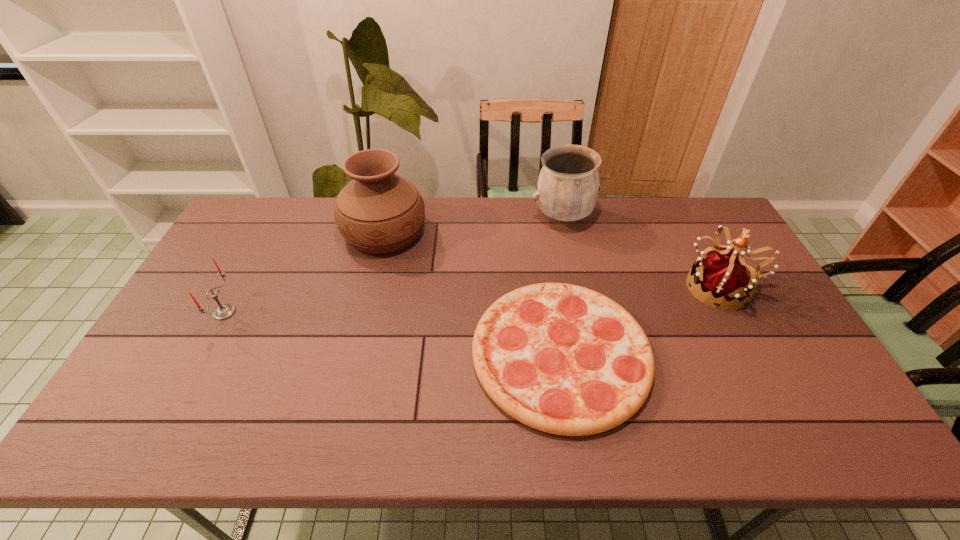
Where is `free spot between the right urn and the leftmost object`? Image resolution: width=960 pixels, height=540 pixels. free spot between the right urn and the leftmost object is located at coordinates (394, 265).

Point out which object is positioned as the third nearest to the right urn. Please provide its 2D coordinates. Your answer should be formatted as a tuple, i.e. [(x, y)], where the tuple contains the x and y coordinates of a point satisfying the conditions above.

[(378, 211)]

Locate which object ranks in proximity to the left urn. Please provide its 2D coordinates. Your answer should be formatted as a tuple, i.e. [(x, y)], where the tuple contains the x and y coordinates of a point satisfying the conditions above.

[(563, 359)]

Locate an element on the screen. The image size is (960, 540). free spot that satisfies the following two spatial constraints: 1. on the front side of the fourth object from right to left; 2. on the front-facing side of the candle is located at coordinates (365, 312).